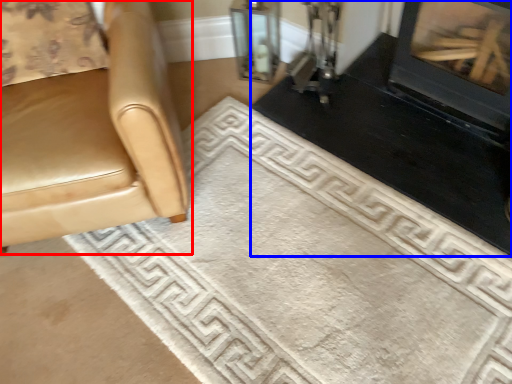
Question: Which object appears farthest to the camera in this image, chair (highlighted by a red box) or fireplace (highlighted by a blue box)?

Choices:
 (A) chair
 (B) fireplace

Answer: (B)